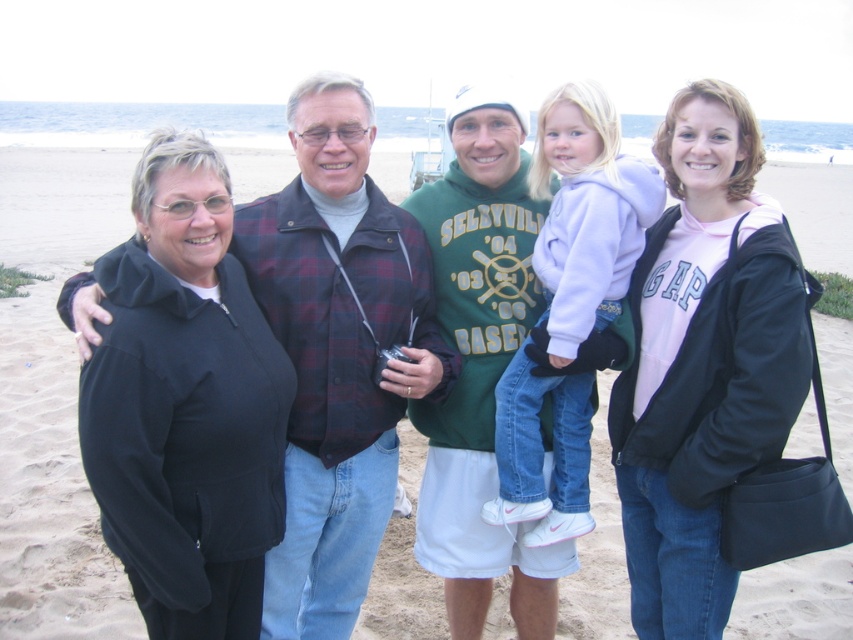
Is point (210, 449) in front of point (697, 170)?

Yes, point (210, 449) is closer to viewer.

Between point (103, 412) and point (735, 570), which one is positioned behind?

Point (735, 570)

Locate an element on the screen. The width and height of the screenshot is (853, 640). black fleece jacket at left is located at coordinates (184, 404).